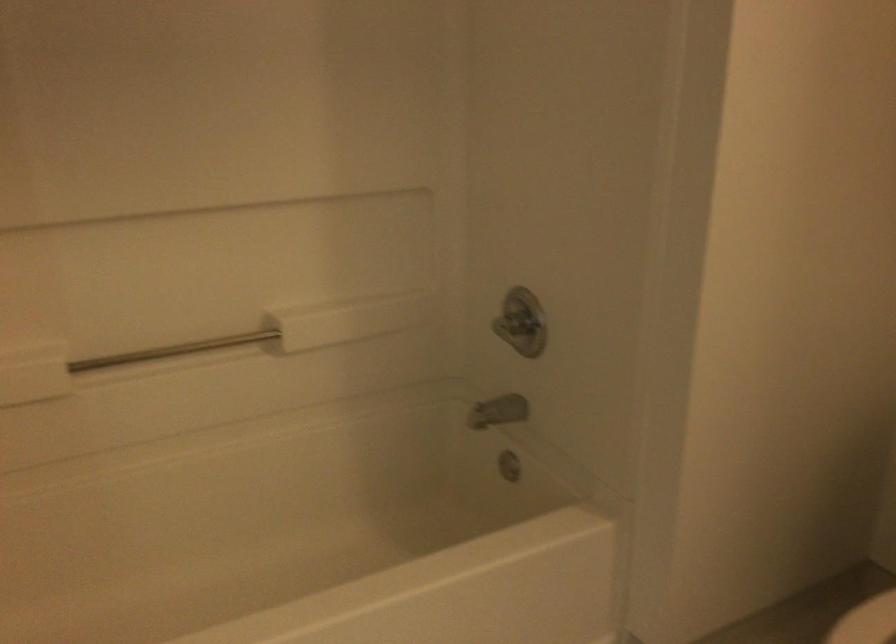
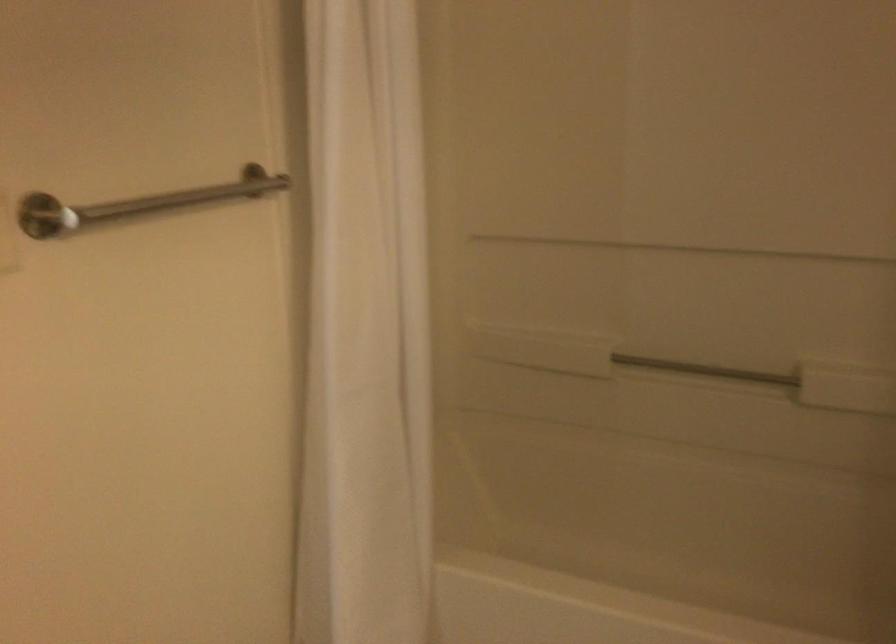
Question: The camera is either moving clockwise (left) or counter-clockwise (right) around the object. The first image is from the beginning of the video and the second image is from the end. Is the camera moving left or right when shooting the video?

Choices:
 (A) Left
 (B) Right

Answer: (B)